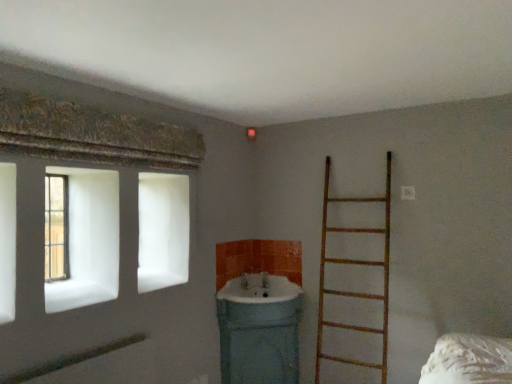
Question: Is wooden frame window at left aimed at matte white sink at center, arranged as the first sink when ordered from the bottom?

Choices:
 (A) no
 (B) yes

Answer: (A)

Question: Is wooden frame window at left not close to matte white sink at center, the 2th sink from the top?

Choices:
 (A) no
 (B) yes

Answer: (B)

Question: Is wooden frame window at left positioned with its back to matte white sink at center, arranged as the first sink when ordered from the bottom?

Choices:
 (A) no
 (B) yes

Answer: (A)

Question: Does wooden frame window at left lie behind matte white sink at center, arranged as the first sink when ordered from the bottom?

Choices:
 (A) yes
 (B) no

Answer: (B)

Question: From a real-world perspective, is wooden frame window at left physically below matte white sink at center, arranged as the first sink when ordered from the bottom?

Choices:
 (A) no
 (B) yes

Answer: (A)

Question: Considering the positions of wooden ladder at right and wooden frame window at left in the image, is wooden ladder at right wider or thinner than wooden frame window at left?

Choices:
 (A) wide
 (B) thin

Answer: (A)

Question: In terms of size, does wooden ladder at right appear bigger or smaller than wooden frame window at left?

Choices:
 (A) small
 (B) big

Answer: (B)

Question: Considering the positions of wooden ladder at right and wooden frame window at left in the image, is wooden ladder at right taller or shorter than wooden frame window at left?

Choices:
 (A) short
 (B) tall

Answer: (B)

Question: Is point (352, 228) closer or farther from the camera than point (58, 218)?

Choices:
 (A) closer
 (B) farther

Answer: (A)

Question: In the image, is white glossy sink at center, placed as the 2th sink when sorted from bottom to top, positioned in front of or behind wooden ladder at right?

Choices:
 (A) front
 (B) behind

Answer: (B)

Question: Would you say white glossy sink at center, placed as the 2th sink when sorted from bottom to top, is inside or outside wooden ladder at right?

Choices:
 (A) outside
 (B) inside

Answer: (A)

Question: Based on their sizes in the image, would you say white glossy sink at center, the 1th sink viewed from the top, is bigger or smaller than wooden ladder at right?

Choices:
 (A) small
 (B) big

Answer: (A)

Question: Does point (272, 276) appear closer or farther from the camera than point (390, 152)?

Choices:
 (A) farther
 (B) closer

Answer: (A)

Question: Considering the positions of white glossy sink at center, the 1th sink viewed from the top, and wooden frame window at left in the image, is white glossy sink at center, the 1th sink viewed from the top, taller or shorter than wooden frame window at left?

Choices:
 (A) short
 (B) tall

Answer: (A)

Question: Does point (264, 299) appear closer or farther from the camera than point (61, 258)?

Choices:
 (A) farther
 (B) closer

Answer: (B)